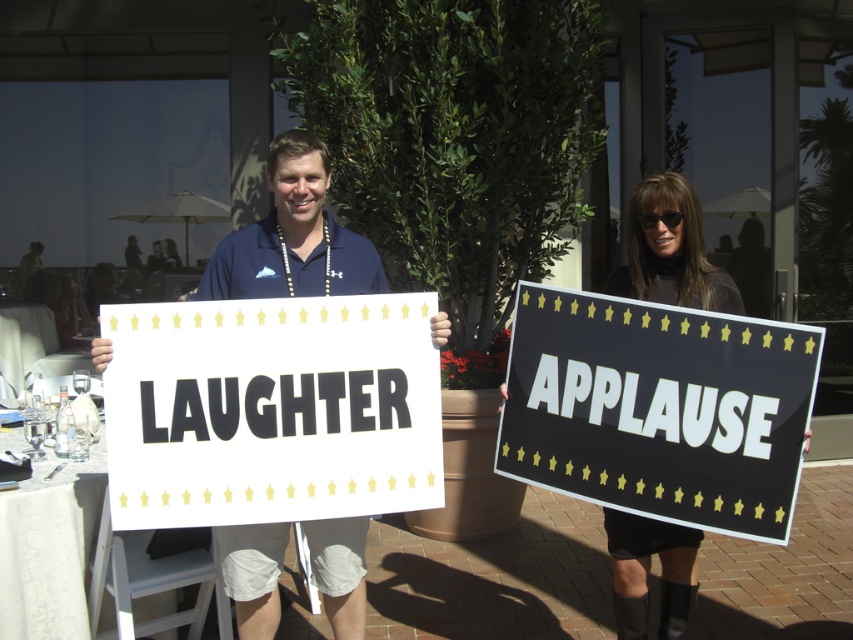
The width and height of the screenshot is (853, 640). What do you see at coordinates (659, 410) in the screenshot?
I see `black matte sign at right` at bounding box center [659, 410].

Does black matte sign at right appear under black leather boots at lower right?

Yes.

What do you see at coordinates (659, 410) in the screenshot?
I see `black matte sign at right` at bounding box center [659, 410].

Identify the location of black matte sign at right. (659, 410).

Is blue fabric shirt at center smaller than black leather boots at lower right?

No, blue fabric shirt at center is not smaller than black leather boots at lower right.

Is blue fabric shirt at center thinner than black leather boots at lower right?

Incorrect, blue fabric shirt at center's width is not less than black leather boots at lower right's.

Where is `blue fabric shirt at center`? Image resolution: width=853 pixels, height=640 pixels. blue fabric shirt at center is located at coordinates (293, 236).

Is point (724, 396) closer to viewer compared to point (303, 172)?

Yes, point (724, 396) is in front of point (303, 172).

Between black matte sign at right and blue fabric shirt at center, which one appears on the left side from the viewer's perspective?

blue fabric shirt at center

Is point (570, 348) positioned in front of point (350, 280)?

Yes, it is.

Find the location of a particular element. The height and width of the screenshot is (640, 853). black matte sign at right is located at coordinates (659, 410).